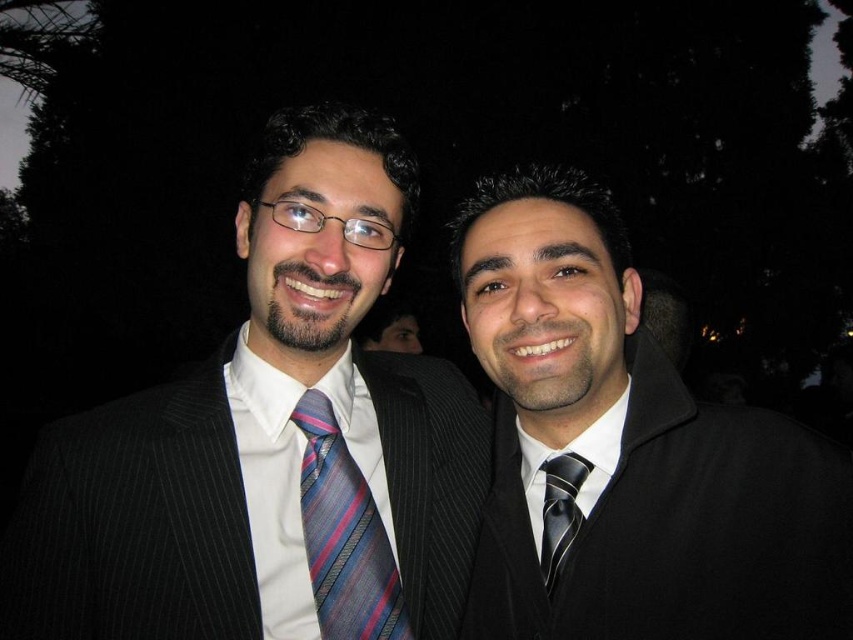
Does black silk suit at center appear on the left side of striped silk tie at center?

In fact, black silk suit at center is to the right of striped silk tie at center.

Between point (659, 376) and point (316, 484), which one is positioned behind?

Positioned behind is point (659, 376).

What are the coordinates of `black silk suit at center` in the screenshot? It's located at (630, 449).

Can you confirm if striped silk tie at center is shorter than black silk tie at center?

Incorrect, striped silk tie at center's height does not fall short of black silk tie at center's.

Does point (316, 589) lie behind point (589, 472)?

That is False.

Is point (341, 627) less distant than point (564, 564)?

Yes, point (341, 627) is in front of point (564, 564).

The image size is (853, 640). I want to click on striped silk tie at center, so click(344, 536).

Is matte black suit at left taller than striped silk tie at center?

Indeed, matte black suit at left has a greater height compared to striped silk tie at center.

Is point (293, 538) more distant than point (380, 582)?

No, (293, 538) is closer to viewer.

At what (x,y) coordinates should I click in order to perform the action: click on matte black suit at left. Please return your answer as a coordinate pair (x, y). The width and height of the screenshot is (853, 640). Looking at the image, I should click on pos(270,442).